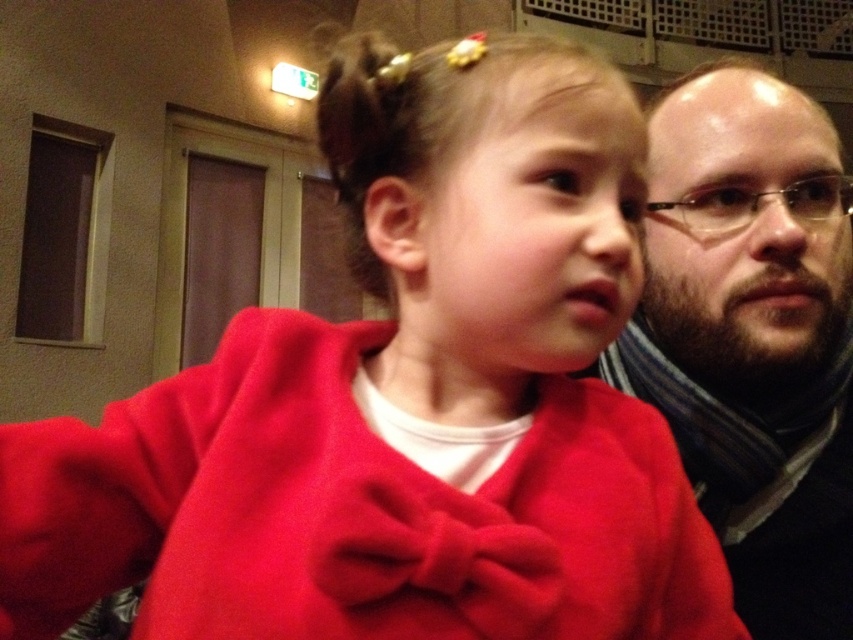
You are a photographer adjusting the focus on your camera. You want to capture a clear image of the dark brown hair at upper right. What is the minimum distance you should set the focus to ensure it is sharp?

The dark brown hair at upper right is located 50.24 centimeters from the camera, so you should set the focus distance to at least 50.24 centimeters to ensure it is sharp.

You are standing in the room where the young girl and adult male are. You need to place a small sticker on the wall behind both of them. According to the image, which point should you choose between point (752, 429) and point (813, 205)?

Point (752, 429) is behind point (813, 205), so you should choose point (752, 429) to place the sticker behind both individuals.

You are standing in a room and see the dark brown hair at upper right and the clear plastic glasses at right. Which object is positioned to the left when viewed from your perspective?

The dark brown hair at upper right is to the left of clear plastic glasses at right.